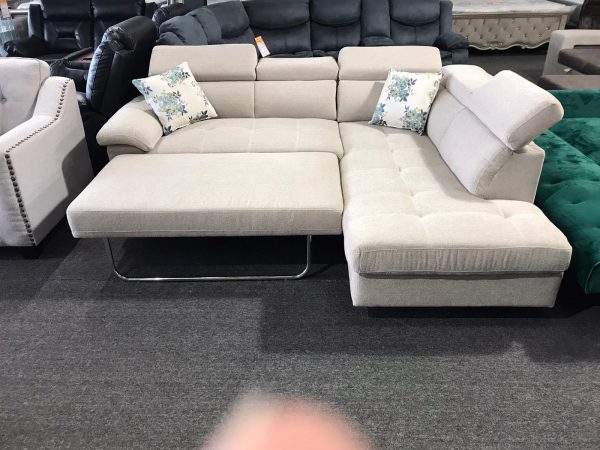
You are a GUI agent. You are given a task and a screenshot of the screen. Output one action in this format:
    pyautogui.click(x=<x>, y=<y>)
    Task: Click on the green sectional
    
    Given the screenshot: What is the action you would take?
    pyautogui.click(x=590, y=208), pyautogui.click(x=579, y=156)